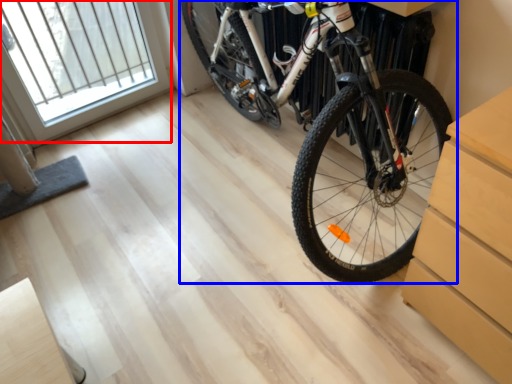
Question: Which point is closer to the camera, window (highlighted by a red box) or bicycle (highlighted by a blue box)?

Choices:
 (A) window
 (B) bicycle

Answer: (B)